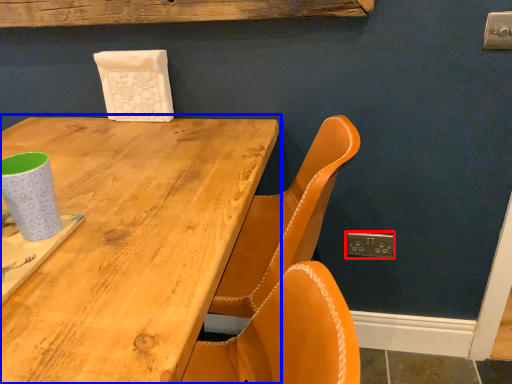
Question: Which point is further to the camera, electric outlet (highlighted by a red box) or table (highlighted by a blue box)?

Choices:
 (A) electric outlet
 (B) table

Answer: (A)